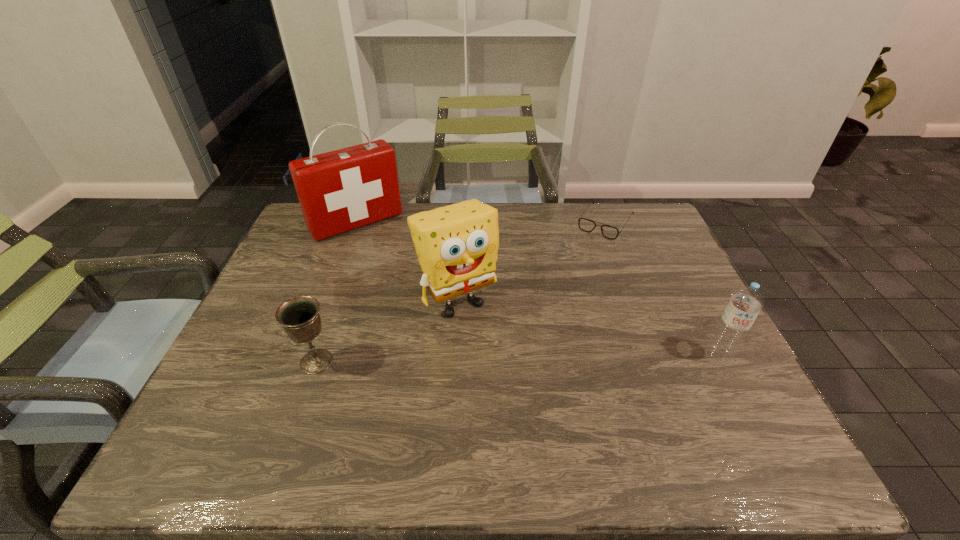
Identify the location of blank space that satisfies the following two spatial constraints: 1. on the front side of the tallest object; 2. on the left side of the rightmost object. The height and width of the screenshot is (540, 960). (307, 356).

Locate an element on the screen. vacant space that satisfies the following two spatial constraints: 1. on the back side of the chalice; 2. on the left side of the rightmost object is located at coordinates (319, 356).